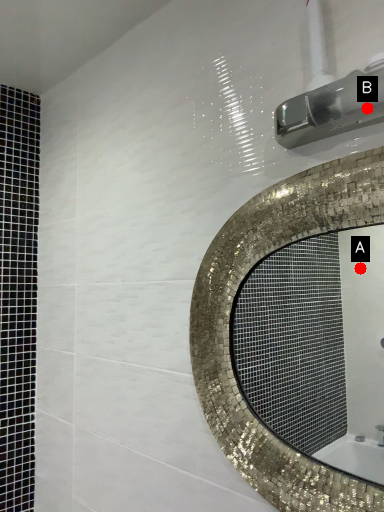
Question: Two points are circled on the image, labeled by A and B beside each circle. Among these points, which one is nearest to the camera?

Choices:
 (A) A is closer
 (B) B is closer

Answer: (B)